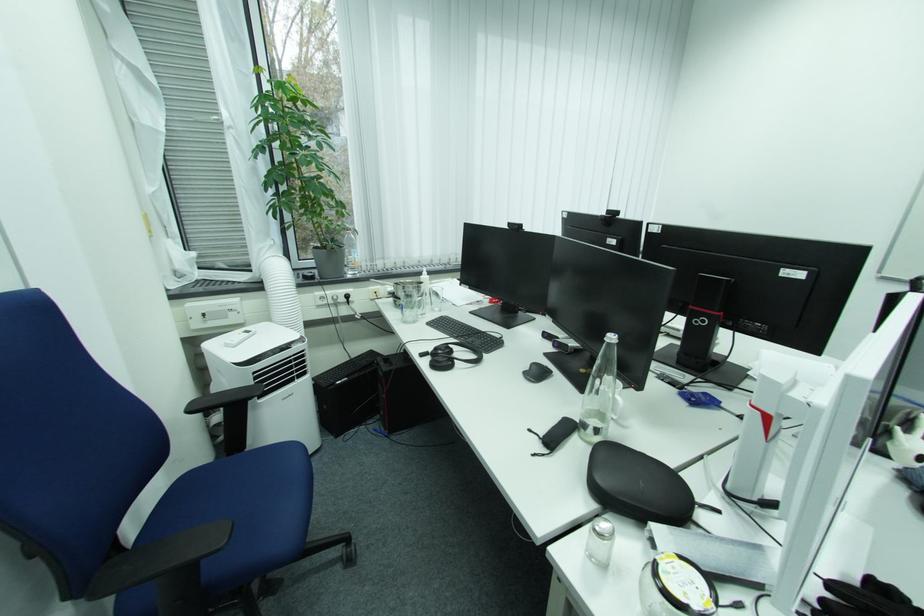
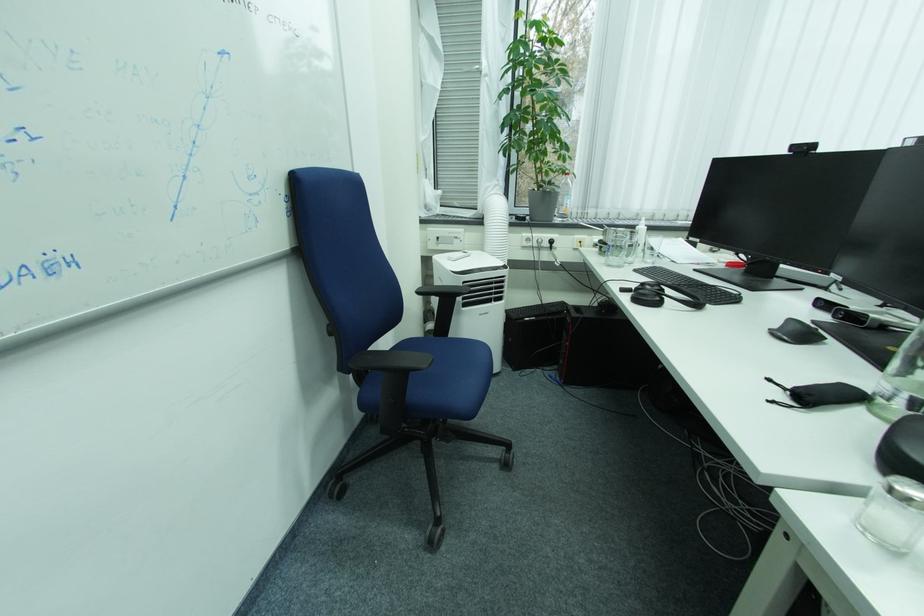
In the second image, find the point that corresponds to pixel 513 228 in the first image.

(792, 153)